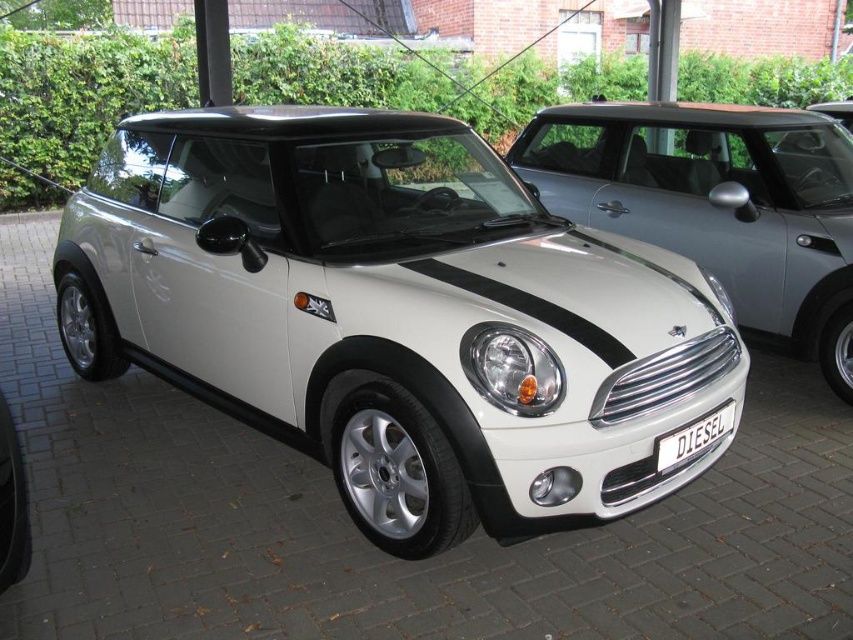
Is white metallic car at center to the left of white matte car at center from the viewer's perspective?

Correct, you'll find white metallic car at center to the left of white matte car at center.

Find the location of a particular element. This screenshot has width=853, height=640. white metallic car at center is located at coordinates (396, 314).

How distant is white metallic car at center from black metallic license plate at center?

white metallic car at center and black metallic license plate at center are 4.09 feet apart from each other.

Does white metallic car at center appear over black metallic license plate at center?

Yes, white metallic car at center is above black metallic license plate at center.

Locate an element on the screen. This screenshot has height=640, width=853. white metallic car at center is located at coordinates (396, 314).

Locate an element on the screen. The width and height of the screenshot is (853, 640). white metallic car at center is located at coordinates (396, 314).

Does point (688, 177) come behind point (706, 424)?

Yes, point (688, 177) is behind point (706, 424).

Is point (770, 166) positioned before point (691, 444)?

No, (770, 166) is further to viewer.

I want to click on white matte car at center, so click(717, 204).